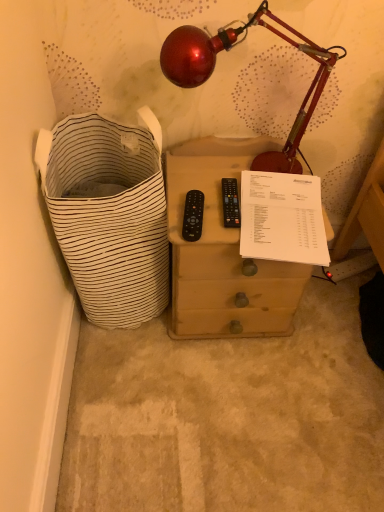
I want to click on vacant space in front of wooden nightstand at center, so click(x=227, y=400).